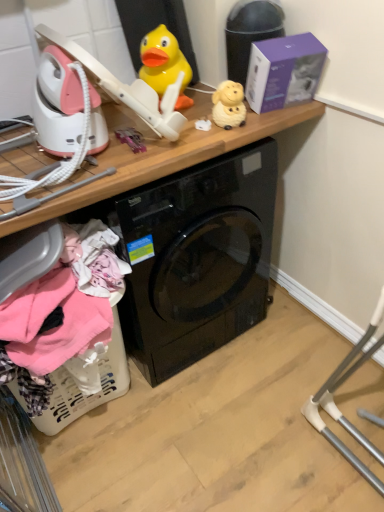
Measure the distance between point [172,50] and camera.

The depth of point [172,50] is 4.38 feet.

Where is `yellow rubber duck at upper center, the second toy positioned from the right`? This screenshot has width=384, height=512. yellow rubber duck at upper center, the second toy positioned from the right is located at coordinates (164, 64).

You are a GUI agent. You are given a task and a screenshot of the screen. Output one action in this format:
    pyautogui.click(x=<x>, y=<y>)
    Task: Click on the purple matte box at upper right
    The height and width of the screenshot is (512, 384).
    Given the screenshot: What is the action you would take?
    pyautogui.click(x=283, y=71)

Which object is positioned more to the right, purple matte box at upper right or white plastic laundry basket at lower left?

Positioned to the right is purple matte box at upper right.

Are purple matte box at upper right and white plastic laundry basket at lower left located far from each other?

That's not correct — purple matte box at upper right is a little close to white plastic laundry basket at lower left.

Can you confirm if purple matte box at upper right is taller than white plastic laundry basket at lower left?

No.

Is white plastic laundry basket at lower left completely or partially inside purple matte box at upper right?

Definitely not — white plastic laundry basket at lower left is not inside purple matte box at upper right.

Between wooden at upper center and matte yellow sheep at upper center, positioned as the first toy in right-to-left order, which one is positioned behind?

matte yellow sheep at upper center, positioned as the first toy in right-to-left order.

Between wooden at upper center and matte yellow sheep at upper center, placed as the 2th toy when sorted from left to right, which one appears on the right side from the viewer's perspective?

matte yellow sheep at upper center, placed as the 2th toy when sorted from left to right.

Is wooden at upper center oriented away from matte yellow sheep at upper center, positioned as the first toy in right-to-left order?

No, wooden at upper center is not facing away from matte yellow sheep at upper center, positioned as the first toy in right-to-left order.

Considering the relative sizes of wooden at upper center and matte yellow sheep at upper center, positioned as the first toy in right-to-left order, in the image provided, is wooden at upper center wider than matte yellow sheep at upper center, positioned as the first toy in right-to-left order,?

Correct, the width of wooden at upper center exceeds that of matte yellow sheep at upper center, positioned as the first toy in right-to-left order.

This screenshot has width=384, height=512. What are the coordinates of `box above the matte yellow sheep at upper center, positioned as the first toy in right-to-left order (from a real-world perspective)` in the screenshot? It's located at (283, 71).

From a real-world perspective, is purple matte box at upper right below matte yellow sheep at upper center, placed as the 2th toy when sorted from left to right?

Actually, purple matte box at upper right is physically above matte yellow sheep at upper center, placed as the 2th toy when sorted from left to right, in the real world.

How different are the orientations of purple matte box at upper right and matte yellow sheep at upper center, placed as the 2th toy when sorted from left to right, in degrees?

purple matte box at upper right and matte yellow sheep at upper center, placed as the 2th toy when sorted from left to right, are facing 1.44 degrees away from each other.

In terms of height, does purple matte box at upper right look taller or shorter compared to matte yellow sheep at upper center, placed as the 2th toy when sorted from left to right?

In the image, purple matte box at upper right appears to be taller than matte yellow sheep at upper center, placed as the 2th toy when sorted from left to right.

Is point (51, 414) closer to camera compared to point (232, 106)?

No.

Looking at this image, could you measure the distance between white plastic laundry basket at lower left and matte yellow sheep at upper center, placed as the 2th toy when sorted from left to right?

They are 35.55 inches apart.

Find the location of `the 1st toy above when counting from the white plastic laundry basket at lower left (from the image's perspective)`. the 1st toy above when counting from the white plastic laundry basket at lower left (from the image's perspective) is located at coordinates (229, 105).

Can you see white plastic laundry basket at lower left touching matte yellow sheep at upper center, placed as the 2th toy when sorted from left to right?

No, white plastic laundry basket at lower left is not touching matte yellow sheep at upper center, placed as the 2th toy when sorted from left to right.

Looking at this image, are yellow rubber duck at upper center, the second toy positioned from the right, and matte yellow sheep at upper center, placed as the 2th toy when sorted from left to right, beside each other?

No, yellow rubber duck at upper center, the second toy positioned from the right, is not touching matte yellow sheep at upper center, placed as the 2th toy when sorted from left to right.

Would you say matte yellow sheep at upper center, placed as the 2th toy when sorted from left to right, is part of yellow rubber duck at upper center, the first toy viewed from the left,'s contents?

Definitely not — matte yellow sheep at upper center, placed as the 2th toy when sorted from left to right, is not inside yellow rubber duck at upper center, the first toy viewed from the left.

From the image's perspective, would you say yellow rubber duck at upper center, the second toy positioned from the right, is positioned over matte yellow sheep at upper center, placed as the 2th toy when sorted from left to right?

Yes, from the image's perspective, yellow rubber duck at upper center, the second toy positioned from the right, is above matte yellow sheep at upper center, placed as the 2th toy when sorted from left to right.

Considering the relative sizes of matte yellow sheep at upper center, positioned as the first toy in right-to-left order, and yellow rubber duck at upper center, the first toy viewed from the left, in the image provided, is matte yellow sheep at upper center, positioned as the first toy in right-to-left order, wider than yellow rubber duck at upper center, the first toy viewed from the left,?

In fact, matte yellow sheep at upper center, positioned as the first toy in right-to-left order, might be narrower than yellow rubber duck at upper center, the first toy viewed from the left.

From the image's perspective, which object appears higher, matte yellow sheep at upper center, positioned as the first toy in right-to-left order, or yellow rubber duck at upper center, the second toy positioned from the right?

yellow rubber duck at upper center, the second toy positioned from the right, is shown above in the image.

Based on their sizes in the image, would you say matte yellow sheep at upper center, placed as the 2th toy when sorted from left to right, is bigger or smaller than yellow rubber duck at upper center, the first toy viewed from the left?

Clearly, matte yellow sheep at upper center, placed as the 2th toy when sorted from left to right, is smaller in size than yellow rubber duck at upper center, the first toy viewed from the left.

Consider the image. Considering their positions, is matte yellow sheep at upper center, placed as the 2th toy when sorted from left to right, located in front of or behind yellow rubber duck at upper center, the second toy positioned from the right?

matte yellow sheep at upper center, placed as the 2th toy when sorted from left to right, is in front of yellow rubber duck at upper center, the second toy positioned from the right.

Can you tell me how much wooden at upper center and white plastic laundry basket at lower left differ in facing direction?

wooden at upper center and white plastic laundry basket at lower left are facing 3.41 degrees away from each other.

Does wooden at upper center have a smaller size compared to white plastic laundry basket at lower left?

→ Actually, wooden at upper center might be larger than white plastic laundry basket at lower left.

Is wooden at upper center far from white plastic laundry basket at lower left?

They are positioned close to each other.

Find the location of a particular element. basket located underneath the purple matte box at upper right (from a real-world perspective) is located at coordinates (79, 389).

From the image's perspective, count 1st toys upward from the wooden at upper center and point to it. Please provide its 2D coordinates.

[(229, 105)]

When comparing their distances from matte yellow sheep at upper center, placed as the 2th toy when sorted from left to right, does white plastic laundry basket at lower left or yellow rubber duck at upper center, the second toy positioned from the right, seem further?

white plastic laundry basket at lower left is further to matte yellow sheep at upper center, placed as the 2th toy when sorted from left to right.

Estimate the real-world distances between objects in this image. Which object is closer to matte yellow sheep at upper center, positioned as the first toy in right-to-left order, purple matte box at upper right or wooden at upper center?

purple matte box at upper right is closer to matte yellow sheep at upper center, positioned as the first toy in right-to-left order.

Looking at the image, which one is located further to wooden at upper center, yellow rubber duck at upper center, the second toy positioned from the right, or purple matte box at upper right?

purple matte box at upper right is positioned further to the anchor wooden at upper center.

Based on their spatial positions, is yellow rubber duck at upper center, the second toy positioned from the right, or wooden at upper center closer to matte yellow sheep at upper center, placed as the 2th toy when sorted from left to right?

Among the two, yellow rubber duck at upper center, the second toy positioned from the right, is located nearer to matte yellow sheep at upper center, placed as the 2th toy when sorted from left to right.

From the image, which object appears to be farther from white plastic laundry basket at lower left, wooden at upper center or matte yellow sheep at upper center, positioned as the first toy in right-to-left order?

matte yellow sheep at upper center, positioned as the first toy in right-to-left order.

From the image, which object appears to be farther from purple matte box at upper right, wooden at upper center or matte yellow sheep at upper center, positioned as the first toy in right-to-left order?

Among the two, wooden at upper center is located further to purple matte box at upper right.

Estimate the real-world distances between objects in this image. Which object is further from wooden at upper center, matte yellow sheep at upper center, placed as the 2th toy when sorted from left to right, or purple matte box at upper right?

purple matte box at upper right.

Based on their spatial positions, is white plastic laundry basket at lower left or purple matte box at upper right further from wooden at upper center?

Among the two, white plastic laundry basket at lower left is located further to wooden at upper center.

In order to click on computer desk that lies between matte yellow sheep at upper center, placed as the 2th toy when sorted from left to right, and white plastic laundry basket at lower left from top to bottom in this screenshot , I will do `click(166, 157)`.

Identify the location of toy between yellow rubber duck at upper center, the first toy viewed from the left, and wooden at upper center in the up-down direction. (229, 105).

Identify the location of toy between yellow rubber duck at upper center, the second toy positioned from the right, and white plastic laundry basket at lower left vertically. This screenshot has width=384, height=512. (229, 105).

At what (x,y) coordinates should I click in order to perform the action: click on box that lies between yellow rubber duck at upper center, the second toy positioned from the right, and wooden at upper center from top to bottom. Please return your answer as a coordinate pair (x, y). The width and height of the screenshot is (384, 512). Looking at the image, I should click on (283, 71).